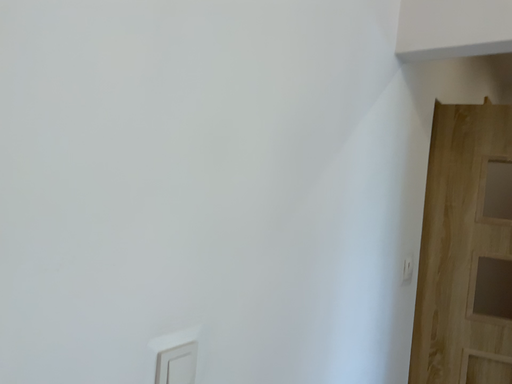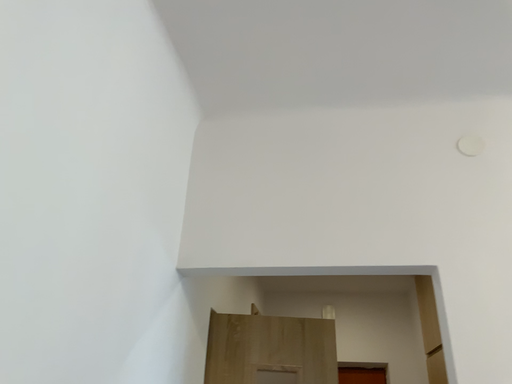
Question: How did the camera likely rotate when shooting the video?

Choices:
 (A) rotated upward
 (B) rotated downward

Answer: (A)